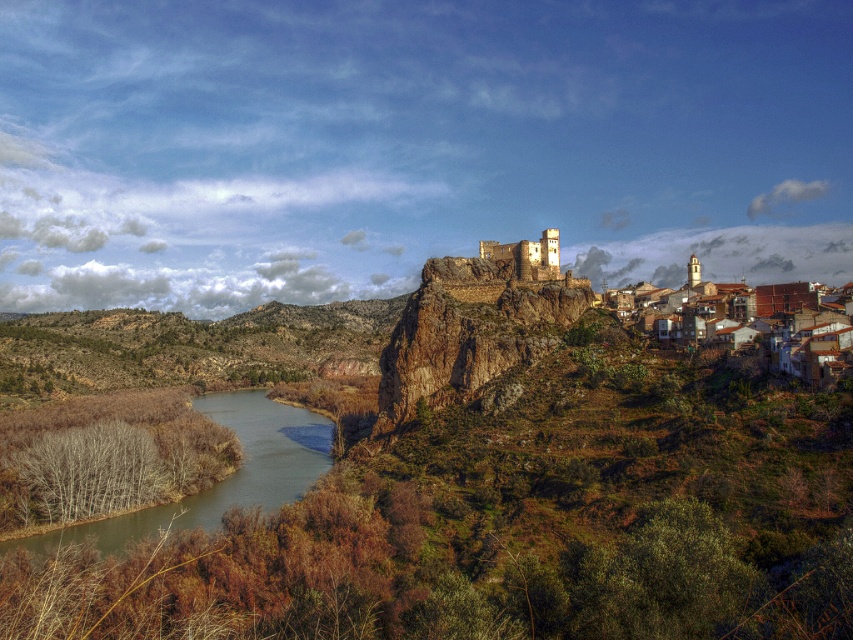
Question: Can you confirm if brown clay houses at lower right is positioned to the right of light brown stone castle at center?

Choices:
 (A) yes
 (B) no

Answer: (A)

Question: Which point appears farthest from the camera in this image?

Choices:
 (A) (x=824, y=372)
 (B) (x=241, y=394)

Answer: (B)

Question: Which point appears farthest from the camera in this image?

Choices:
 (A) (520, 268)
 (B) (329, 445)

Answer: (B)

Question: Which of the following is the closest to the observer?

Choices:
 (A) (22, 540)
 (B) (534, 275)

Answer: (A)

Question: Considering the relative positions of brown clay houses at lower right and light brown stone castle at center in the image provided, where is brown clay houses at lower right located with respect to light brown stone castle at center?

Choices:
 (A) below
 (B) above

Answer: (A)

Question: Can you confirm if brown/rough water at lower left is thinner than light brown stone castle at center?

Choices:
 (A) yes
 (B) no

Answer: (B)